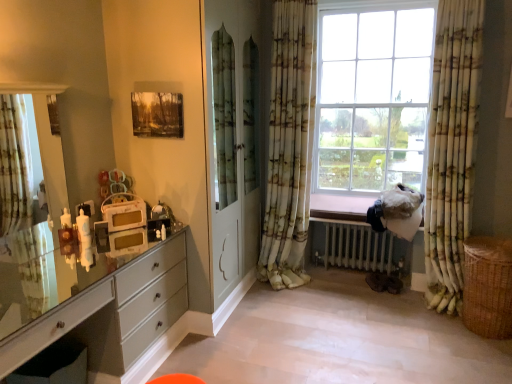
Where is `green floral curtain at left, which is the 1th curtain from left to right`? The height and width of the screenshot is (384, 512). green floral curtain at left, which is the 1th curtain from left to right is located at coordinates (23, 220).

This screenshot has width=512, height=384. What do you see at coordinates (113, 314) in the screenshot?
I see `white glossy chest of drawers at lower left` at bounding box center [113, 314].

Describe the element at coordinates (289, 144) in the screenshot. I see `green and white floral curtain at center, positioned as the second curtain in right-to-left order` at that location.

Where is `green and white floral curtain at center, which is the 2th curtain in left-to-right order`? green and white floral curtain at center, which is the 2th curtain in left-to-right order is located at coordinates (289, 144).

What is the approximate height of braided wicker basket at lower right?

The height of braided wicker basket at lower right is 22.43 inches.

Image resolution: width=512 pixels, height=384 pixels. I want to click on green and white textured curtain at right, which is counted as the first curtain, starting from the right, so click(x=451, y=148).

Identify the location of white metallic radiator at lower right. The height and width of the screenshot is (384, 512). (357, 246).

From the image's perspective, which is below, white glossy chest of drawers at lower left or matte white clock at left?

From the image's view, white glossy chest of drawers at lower left is below.

Considering the points (162, 306) and (103, 222), which point is behind, point (162, 306) or point (103, 222)?

The point (162, 306) is more distant.

Find the location of a particular element. The width and height of the screenshot is (512, 384). appliance behind the white glossy chest of drawers at lower left is located at coordinates (125, 225).

Choose the correct answer: Is green and white floral curtain at center, positioned as the second curtain in right-to-left order, inside matte wooden picture frame at upper center or outside it?

green and white floral curtain at center, positioned as the second curtain in right-to-left order, is spatially situated outside matte wooden picture frame at upper center.

Considering the relative sizes of green and white floral curtain at center, positioned as the second curtain in right-to-left order, and matte wooden picture frame at upper center in the image provided, is green and white floral curtain at center, positioned as the second curtain in right-to-left order, thinner than matte wooden picture frame at upper center?

No, green and white floral curtain at center, positioned as the second curtain in right-to-left order, is not thinner than matte wooden picture frame at upper center.

Is green and white floral curtain at center, positioned as the second curtain in right-to-left order, aimed at matte wooden picture frame at upper center?

No, green and white floral curtain at center, positioned as the second curtain in right-to-left order, is not facing towards matte wooden picture frame at upper center.

Is green and white floral curtain at center, which is the 2th curtain in left-to-right order, in contact with matte wooden picture frame at upper center?

There is a gap between green and white floral curtain at center, which is the 2th curtain in left-to-right order, and matte wooden picture frame at upper center.

From a real-world perspective, is matte wooden picture frame at upper center positioned over white metallic radiator at lower right based on gravity?

Yes, from a real-world perspective, matte wooden picture frame at upper center is above white metallic radiator at lower right.

Consider the image. Is matte wooden picture frame at upper center far from white metallic radiator at lower right?

Yes, matte wooden picture frame at upper center is far from white metallic radiator at lower right.

Who is shorter, matte wooden picture frame at upper center or white metallic radiator at lower right?

With less height is matte wooden picture frame at upper center.

Based on the photo, is green floral curtain at left, which appears as the 3th curtain when viewed from the right, inside or outside of white metallic radiator at lower right?

green floral curtain at left, which appears as the 3th curtain when viewed from the right, is outside white metallic radiator at lower right.

Is green floral curtain at left, which is the 1th curtain from left to right, in front of or behind white metallic radiator at lower right in the image?

Clearly, green floral curtain at left, which is the 1th curtain from left to right, is in front of white metallic radiator at lower right.

Who is smaller, green floral curtain at left, which is the 1th curtain from left to right, or white metallic radiator at lower right?

green floral curtain at left, which is the 1th curtain from left to right.

Is point (12, 186) positioned in front of point (381, 259)?

Yes, it is in front of point (381, 259).

Is point (472, 40) in front of point (275, 243)?

That is True.

Is green and white textured curtain at right, placed as the 3th curtain when sorted from left to right, taller or shorter than green and white floral curtain at center, which is the 2th curtain in left-to-right order?

green and white textured curtain at right, placed as the 3th curtain when sorted from left to right, is shorter than green and white floral curtain at center, which is the 2th curtain in left-to-right order.

Looking at this image, is green and white floral curtain at center, which is the 2th curtain in left-to-right order, surrounded by green and white textured curtain at right, which is counted as the first curtain, starting from the right?

Actually, green and white floral curtain at center, which is the 2th curtain in left-to-right order, is outside green and white textured curtain at right, which is counted as the first curtain, starting from the right.

Which object is positioned more to the right, green and white floral curtain at center, positioned as the second curtain in right-to-left order, or white metallic radiator at lower right?

From the viewer's perspective, white metallic radiator at lower right appears more on the right side.

Can we say green and white floral curtain at center, which is the 2th curtain in left-to-right order, lies outside white metallic radiator at lower right?

Absolutely, green and white floral curtain at center, which is the 2th curtain in left-to-right order, is external to white metallic radiator at lower right.

Can you confirm if green and white floral curtain at center, which is the 2th curtain in left-to-right order, is wider than white metallic radiator at lower right?

In fact, green and white floral curtain at center, which is the 2th curtain in left-to-right order, might be narrower than white metallic radiator at lower right.

Is green and white floral curtain at center, positioned as the second curtain in right-to-left order, aimed at white metallic radiator at lower right?

No, green and white floral curtain at center, positioned as the second curtain in right-to-left order, is not turned towards white metallic radiator at lower right.

Which of these two, green and white floral curtain at center, which is the 2th curtain in left-to-right order, or green and white textured curtain at right, which is counted as the first curtain, starting from the right, stands taller?

green and white floral curtain at center, which is the 2th curtain in left-to-right order, is taller.

Does green and white floral curtain at center, which is the 2th curtain in left-to-right order, turn towards green and white textured curtain at right, placed as the 3th curtain when sorted from left to right?

No, green and white floral curtain at center, which is the 2th curtain in left-to-right order, is not aimed at green and white textured curtain at right, placed as the 3th curtain when sorted from left to right.

Are green and white floral curtain at center, which is the 2th curtain in left-to-right order, and green and white textured curtain at right, placed as the 3th curtain when sorted from left to right, beside each other?

No, green and white floral curtain at center, which is the 2th curtain in left-to-right order, is not beside green and white textured curtain at right, placed as the 3th curtain when sorted from left to right.

The width and height of the screenshot is (512, 384). What are the coordinates of `appliance that appears above the white glossy chest of drawers at lower left (from the image's perspective)` in the screenshot? It's located at (125, 225).

In order to click on the 1st curtain below the matte wooden picture frame at upper center (from the image's perspective) in this screenshot , I will do `click(289, 144)`.

From the image, which object appears to be nearer to green and white floral curtain at center, which is the 2th curtain in left-to-right order, white glossy chest of drawers at lower left or braided wicker basket at lower right?

white glossy chest of drawers at lower left.

Estimate the real-world distances between objects in this image. Which object is closer to braided wicker basket at lower right, green floral curtain at left, which is the 1th curtain from left to right, or green and white floral curtain at center, positioned as the second curtain in right-to-left order?

green and white floral curtain at center, positioned as the second curtain in right-to-left order, is closer to braided wicker basket at lower right.

When comparing their distances from white metallic radiator at lower right, does matte white clock at left or matte wooden picture frame at upper center seem further?

matte wooden picture frame at upper center.

From the picture: Estimate the real-world distances between objects in this image. Which object is closer to green and white floral curtain at center, which is the 2th curtain in left-to-right order, green floral curtain at left, which appears as the 3th curtain when viewed from the right, or matte white clock at left?

matte white clock at left lies closer to green and white floral curtain at center, which is the 2th curtain in left-to-right order, than the other object.

When comparing their distances from braided wicker basket at lower right, does white metallic radiator at lower right or green floral curtain at left, which is the 1th curtain from left to right, seem further?

green floral curtain at left, which is the 1th curtain from left to right, is positioned further to the anchor braided wicker basket at lower right.

From the image, which object appears to be nearer to braided wicker basket at lower right, white glossy chest of drawers at lower left or white metallic radiator at lower right?

Based on the image, white metallic radiator at lower right appears to be nearer to braided wicker basket at lower right.

Based on their spatial positions, is white metallic radiator at lower right or green and white textured curtain at right, which is counted as the first curtain, starting from the right, closer to white glossy chest of drawers at lower left?

white metallic radiator at lower right.

Considering their positions, is matte white clock at left positioned further to matte wooden picture frame at upper center than green and white textured curtain at right, placed as the 3th curtain when sorted from left to right?

green and white textured curtain at right, placed as the 3th curtain when sorted from left to right, is further to matte wooden picture frame at upper center.

You are a GUI agent. You are given a task and a screenshot of the screen. Output one action in this format:
    pyautogui.click(x=<x>, y=<y>)
    Task: Click on the radiator between green floral curtain at left, which is the 1th curtain from left to right, and braided wicker basket at lower right, in the horizontal direction
    Image resolution: width=512 pixels, height=384 pixels.
    Given the screenshot: What is the action you would take?
    pyautogui.click(x=357, y=246)

The height and width of the screenshot is (384, 512). Identify the location of appliance between green floral curtain at left, which is the 1th curtain from left to right, and green and white textured curtain at right, placed as the 3th curtain when sorted from left to right. (125, 225).

Locate an element on the screen. appliance located between white glossy chest of drawers at lower left and green and white floral curtain at center, positioned as the second curtain in right-to-left order, in the depth direction is located at coordinates (125, 225).

I want to click on radiator between matte wooden picture frame at upper center and green and white textured curtain at right, which is counted as the first curtain, starting from the right, in the horizontal direction, so click(357, 246).